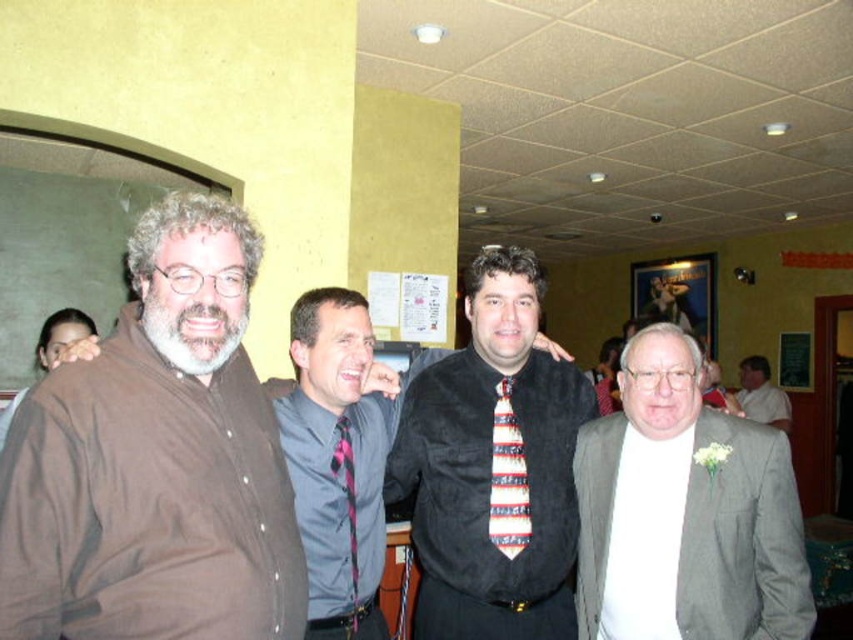
Based on the coordinates provided, which object is located at point (685, 513) in the image?

The point (685, 513) corresponds to the gray wool suit at right.

Looking at this image, based on the coordinates provided, which man is located at point (x=155, y=460) in the image?

The point (x=155, y=460) corresponds to the brown shirt at left.

You are a photographer who needs to adjust the height of your camera to capture both the gray wool suit at right and the brown matte shirt at left in the same frame. Which subject should you focus on first to ensure both are in frame?

The gray wool suit at right is shorter than the brown matte shirt at left. To capture both in the same frame, focus on the brown matte shirt at left first, then adjust the camera angle downward to include the shorter gray wool suit at right.